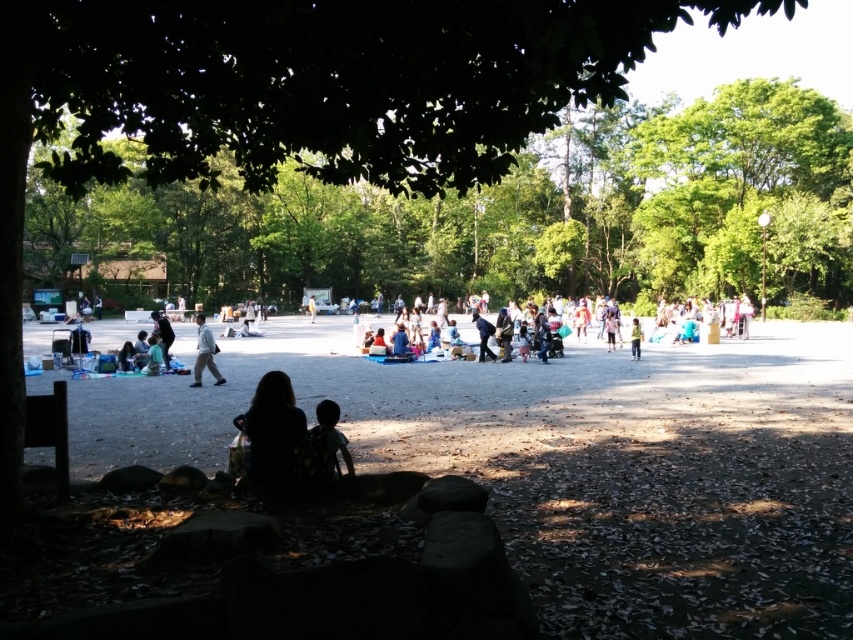
You are standing at the edge of the park and see the green leafy tree at center and the matte black jacket at lower left. Which object is located to the right of the other?

The green leafy tree at center is positioned on the right side of matte black jacket at lower left.

You are planning to set up a small tent in the open area of the park. You notice the green leafy tree at center and the light blue fabric at center. Which object should you place your tent closer to if you want it to be in the shade?

You should place your tent closer to the green leafy tree at center because it provides shade, whereas the light blue fabric at center does not offer shade.

You are standing at the center of the park and see the matte black jacket at lower left. If you walk straight ahead, will you reach the jacket before the shaded area under the large tree?

The matte black jacket at lower left is located at point (161,336). Since the jacket is in the lower left area, walking straight ahead from the center would likely take you towards the shaded area under the large tree first, so you would reach the shaded area before the jacket.